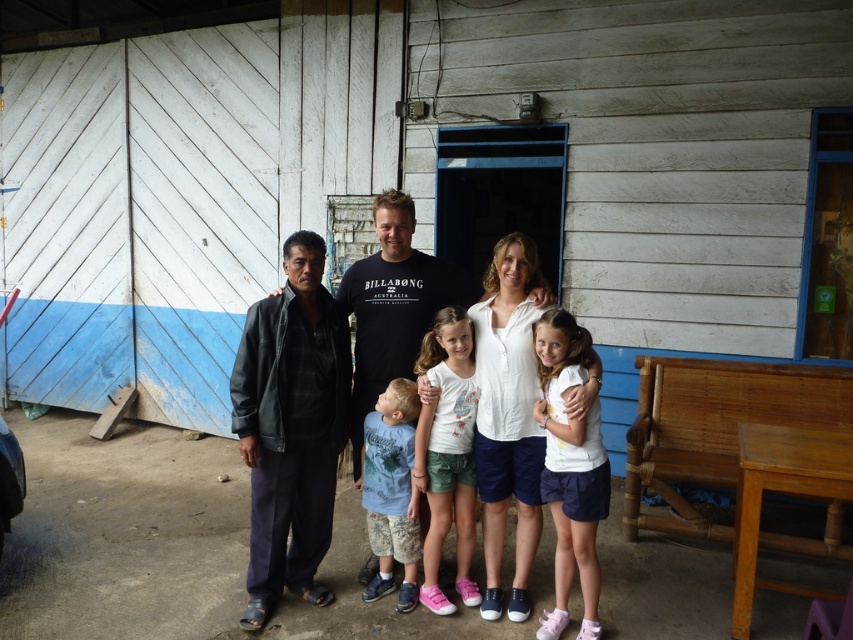
Does point (556, 557) come farther from viewer compared to point (432, 292)?

No, it is not.

Is white matte shirt at center closer to camera compared to matte black jacket at center?

Yes, white matte shirt at center is in front of matte black jacket at center.

Is point (563, 484) closer to camera compared to point (381, 250)?

Yes, point (563, 484) is closer to viewer.

At what (x,y) coordinates should I click in order to perform the action: click on white matte shirt at center. Please return your answer as a coordinate pair (x, y). The image size is (853, 640). Looking at the image, I should click on (569, 468).

Does dark gray leather jacket at left appear over white matte shirt at center?

Yes, dark gray leather jacket at left is above white matte shirt at center.

Who is lower down, dark gray leather jacket at left or white matte shirt at center?

white matte shirt at center

In the scene shown: Who is more distant from viewer, (x=331, y=332) or (x=566, y=371)?

Positioned behind is point (x=331, y=332).

Find the location of a particular element. dark gray leather jacket at left is located at coordinates (289, 426).

Is light blue cotton shirt at lower left taller than matte black jacket at center?

Incorrect, light blue cotton shirt at lower left's height is not larger of matte black jacket at center's.

This screenshot has width=853, height=640. In order to click on light blue cotton shirt at lower left in this screenshot , I will do `click(392, 490)`.

Is point (410, 442) farther from viewer compared to point (405, 253)?

That is False.

In order to click on light blue cotton shirt at lower left in this screenshot , I will do `click(392, 490)`.